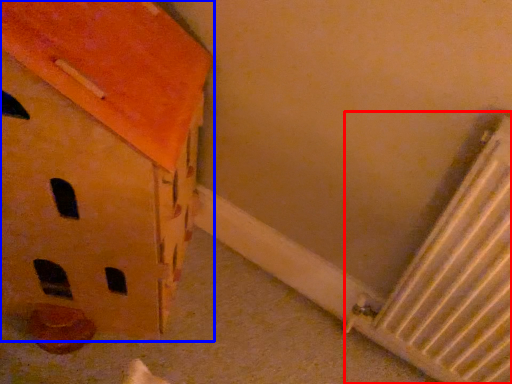
Question: Which object is closer to the camera taking this photo, radiator (highlighted by a red box) or cardboard box (highlighted by a blue box)?

Choices:
 (A) radiator
 (B) cardboard box

Answer: (B)